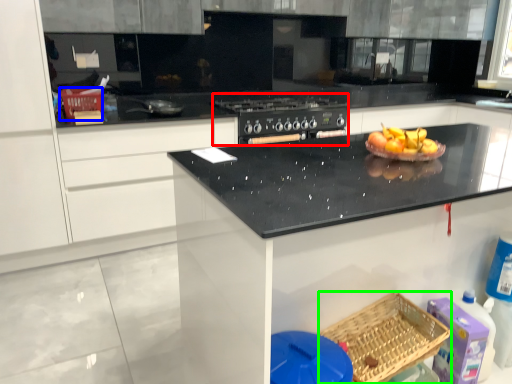
Question: Estimate the real-world distances between objects in this image. Which object is farther from appliance (highlighted by a red box), basket (highlighted by a blue box) or basket (highlighted by a green box)?

Choices:
 (A) basket
 (B) basket

Answer: (B)